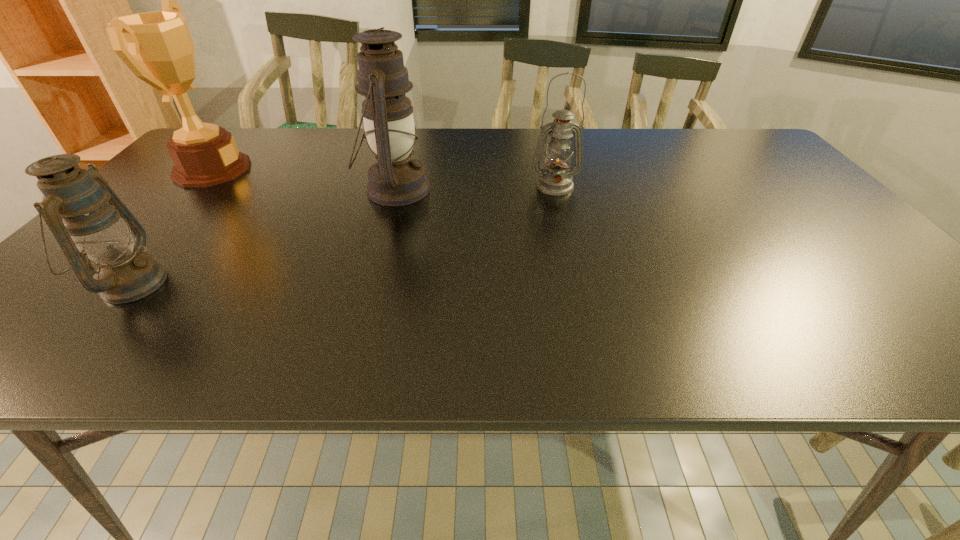
Where is `object that is positioned at the far edge`? This screenshot has height=540, width=960. object that is positioned at the far edge is located at coordinates (157, 46).

The image size is (960, 540). In order to click on award at the left edge in this screenshot , I will do `click(157, 46)`.

The width and height of the screenshot is (960, 540). Find the location of `oil lamp that is at the left edge`. oil lamp that is at the left edge is located at coordinates (74, 206).

Locate an element on the screen. The image size is (960, 540). object situated at the far left corner is located at coordinates pos(157,46).

In the image, there is a desktop. At what (x,y) coordinates should I click in order to perform the action: click on vacant space at the far edge. Please return your answer as a coordinate pair (x, y). Looking at the image, I should click on (464, 160).

In the image, there is a desktop. Identify the location of vacant space at the near edge. [707, 337].

In the image, there is a desktop. Identify the location of vacant space at the left edge. (26, 321).

You are a GUI agent. You are given a task and a screenshot of the screen. Output one action in this format:
    pyautogui.click(x=<x>, y=<y>)
    Task: Click on the vacant space at the right edge of the desktop
    
    Given the screenshot: What is the action you would take?
    pyautogui.click(x=804, y=213)

Locate an element on the screen. The height and width of the screenshot is (540, 960). vacant space in between the rightmost oil lamp and the second object from right to left is located at coordinates [474, 188].

The image size is (960, 540). Find the location of `unoccupied position between the rightmost oil lamp and the tallest oil lamp`. unoccupied position between the rightmost oil lamp and the tallest oil lamp is located at coordinates (474, 188).